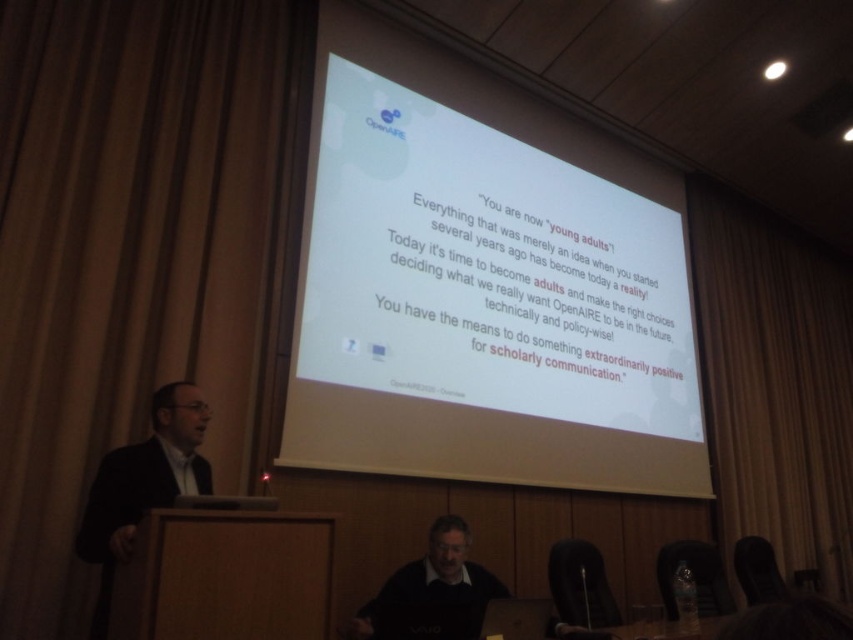
You are standing in the conference room and want to present your slides using a remote control. The remote control has a maximum effective range of 10 feet. Will you be able to control the presentation from where you are standing in front of the white matte projector screen at upper center?

The white matte projector screen at upper center is 11.08 feet away from the viewer. Since the remote control has a maximum effective range of 10 feet, you will be out of range and unable to control the presentation from your current position.

Looking at this image, where is the brown fabric curtain at left located in the image?

The brown fabric curtain at left is located at point (125, 253) in the image.

You are attending a presentation and see a wooden table at lower left and a dark gray sweater at lower center. Which object is positioned higher in the image?

The wooden table at lower left is positioned higher than the dark gray sweater at lower center because it is above it in the image.